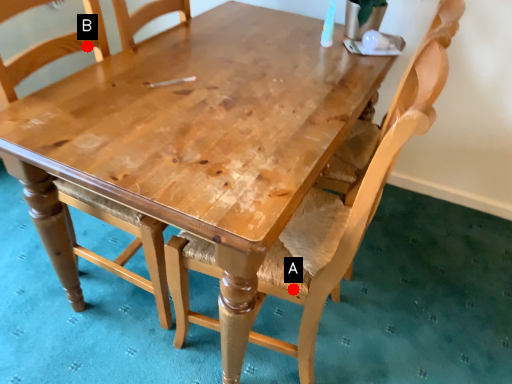
Question: Two points are circled on the image, labeled by A and B beside each circle. Which point is farther to the camera?

Choices:
 (A) A is further
 (B) B is further

Answer: (B)